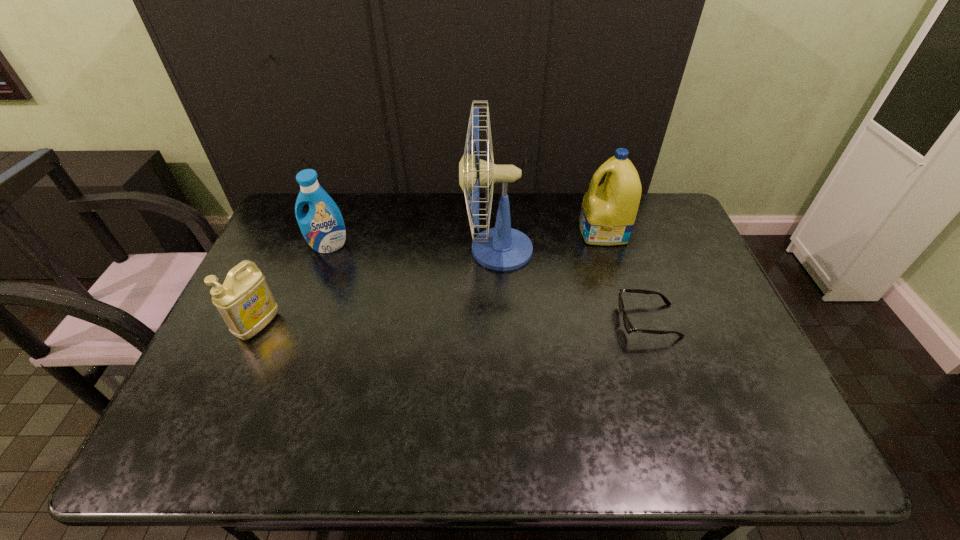
You are a GUI agent. You are given a task and a screenshot of the screen. Output one action in this format:
    pyautogui.click(x=<x>, y=<y>)
    Task: Click on the vacant point located 0.270m on the label of the rightmost detergent
    The image size is (960, 540).
    Given the screenshot: What is the action you would take?
    pyautogui.click(x=499, y=232)

Find the location of a particular element. The width and height of the screenshot is (960, 540). free point located 0.090m on the label of the rightmost detergent is located at coordinates (553, 232).

Where is `vacant region located on the front of the nearest detergent`? The height and width of the screenshot is (540, 960). vacant region located on the front of the nearest detergent is located at coordinates [206, 441].

Locate an element on the screen. This screenshot has width=960, height=540. free spot located on the lenses of the spectacles is located at coordinates (600, 321).

This screenshot has height=540, width=960. What are the coordinates of `vacant area situated on the lenses of the spectacles` in the screenshot? It's located at (498, 321).

Where is `vacant space situated 0.170m on the lenses of the spectacles`? vacant space situated 0.170m on the lenses of the spectacles is located at coordinates pos(557,321).

Find the location of a particular element. Image resolution: width=960 pixels, height=540 pixels. fan that is at the far edge is located at coordinates (502, 248).

Locate an element on the screen. detergent at the far edge is located at coordinates (608, 212).

Find the location of a particular element. Image resolution: width=960 pixels, height=540 pixels. object located in the right edge section of the desktop is located at coordinates (628, 326).

Where is `vacant region at the far edge of the desktop`? vacant region at the far edge of the desktop is located at coordinates (413, 230).